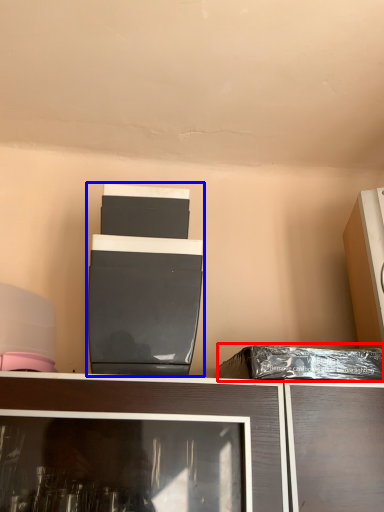
Question: Which of the following is the farthest to the observer, garbage (highlighted by a red box) or appliance (highlighted by a blue box)?

Choices:
 (A) garbage
 (B) appliance

Answer: (A)